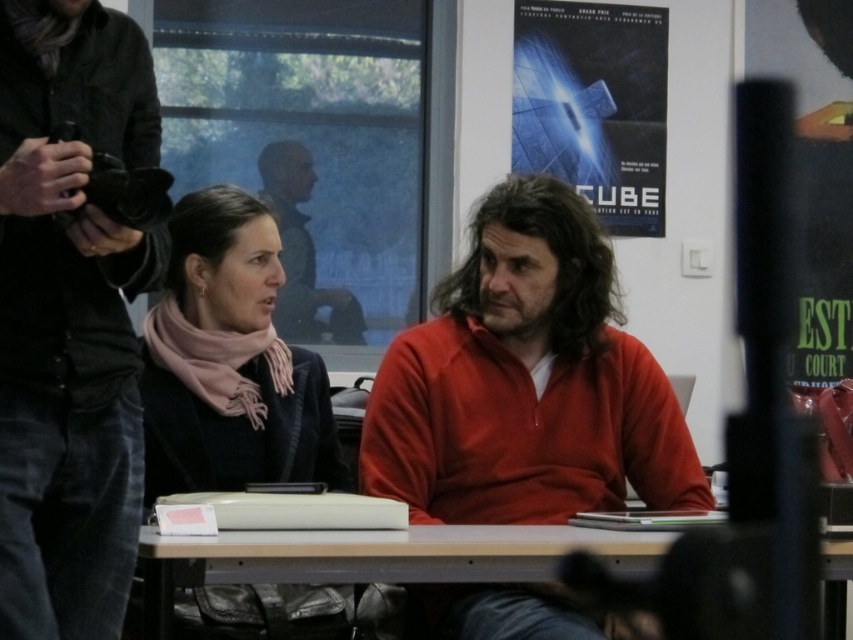
You are a delivery person who needs to place a small package on the wooden table at center without touching the pink scarf at center. Is there enough space between them to do this?

The pink scarf at center is 22.85 inches away from the wooden table at center. Since the package is small, there is sufficient space to place it on the wooden table at center without touching the pink scarf at center.